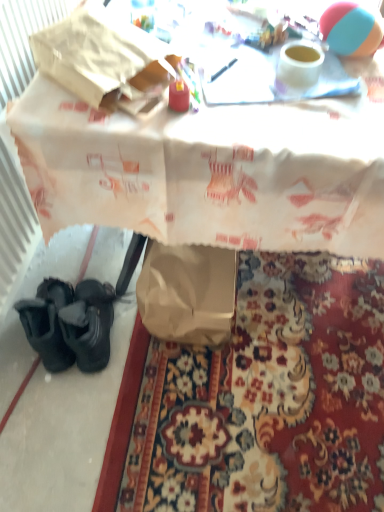
Image resolution: width=384 pixels, height=512 pixels. What do you see at coordinates (270, 398) in the screenshot? I see `brown paper bag at lower left` at bounding box center [270, 398].

What are the coordinates of `rubber beach ball at upper right` in the screenshot? It's located at (351, 29).

Consider the image. Measure the distance between white paper bag at lower left and camera.

The depth of white paper bag at lower left is 30.29 inches.

I want to click on brown paper bag at lower left, so click(270, 398).

Is point (339, 23) positioned before point (243, 438)?

Yes, point (339, 23) is closer to viewer.

Does rubber beach ball at upper right come behind brown paper bag at lower left?

No.

From the picture: From a real-world perspective, does rubber beach ball at upper right sit lower than brown paper bag at lower left?

Actually, rubber beach ball at upper right is physically above brown paper bag at lower left in the real world.

Does rubber beach ball at upper right have a smaller size compared to brown paper bag at lower left?

Yes, rubber beach ball at upper right is smaller than brown paper bag at lower left.

Between white paper bag at lower left and rubber beach ball at upper right, which one appears on the left side from the viewer's perspective?

From the viewer's perspective, white paper bag at lower left appears more on the left side.

Can you confirm if white paper bag at lower left is bigger than rubber beach ball at upper right?

Correct, white paper bag at lower left is larger in size than rubber beach ball at upper right.

What's the angular difference between white paper bag at lower left and rubber beach ball at upper right's facing directions?

white paper bag at lower left and rubber beach ball at upper right are facing 0.107 degrees away from each other.

From the image's perspective, is white paper bag at lower left on top of brown paper bag at lower left?

Yes, from the image's perspective, white paper bag at lower left is over brown paper bag at lower left.

From a real-world perspective, between white paper bag at lower left and brown paper bag at lower left, who is vertically lower?

brown paper bag at lower left, from a real-world perspective.

Between white paper bag at lower left and brown paper bag at lower left, which one is positioned behind?

brown paper bag at lower left is more distant.

From a real-world perspective, is rubber beach ball at upper right physically below white paper bag at lower left?

No.

Is rubber beach ball at upper right in front of or behind white paper bag at lower left in the image?

Answer: In the image, rubber beach ball at upper right appears behind white paper bag at lower left.

Would you say rubber beach ball at upper right is to the left or to the right of white paper bag at lower left in the picture?

From the image, it's evident that rubber beach ball at upper right is to the right of white paper bag at lower left.

Is brown paper bag at lower left oriented towards rubber beach ball at upper right?

No, brown paper bag at lower left is not turned towards rubber beach ball at upper right.

Does brown paper bag at lower left have a lesser width compared to rubber beach ball at upper right?

Incorrect, the width of brown paper bag at lower left is not less than that of rubber beach ball at upper right.

Is brown paper bag at lower left outside of rubber beach ball at upper right?

brown paper bag at lower left is positioned outside rubber beach ball at upper right.

Which of these two, brown paper bag at lower left or rubber beach ball at upper right, is smaller?

Smaller between the two is rubber beach ball at upper right.

Considering the positions of objects brown paper bag at lower left and white paper bag at lower left in the image provided, who is behind, brown paper bag at lower left or white paper bag at lower left?

brown paper bag at lower left is behind.

How many degrees apart are the facing directions of brown paper bag at lower left and white paper bag at lower left?

They differ by 179 degrees in their facing directions.

Can you confirm if brown paper bag at lower left is positioned to the left of white paper bag at lower left?

Correct, you'll find brown paper bag at lower left to the left of white paper bag at lower left.

Measure the distance between brown paper bag at lower left and white paper bag at lower left.

A distance of 18.45 inches exists between brown paper bag at lower left and white paper bag at lower left.

At what (x,y) coordinates should I click in order to perform the action: click on mat directly beneath the rubber beach ball at upper right (from a real-world perspective). Please return your answer as a coordinate pair (x, y). Looking at the image, I should click on (270, 398).

This screenshot has width=384, height=512. Identify the location of ball on the right of white paper bag at lower left. click(x=351, y=29).

From the image, which object appears to be farther from brown paper bag at lower left, white paper bag at lower left or rubber beach ball at upper right?

rubber beach ball at upper right lies further to brown paper bag at lower left than the other object.

Based on the photo, considering their positions, is rubber beach ball at upper right positioned closer to brown paper bag at lower left than white paper bag at lower left?

The object closer to brown paper bag at lower left is white paper bag at lower left.

From the image, which object appears to be farther from white paper bag at lower left, rubber beach ball at upper right or brown paper bag at lower left?

brown paper bag at lower left lies further to white paper bag at lower left than the other object.

Estimate the real-world distances between objects in this image. Which object is further from rubber beach ball at upper right, white paper bag at lower left or brown paper bag at lower left?

brown paper bag at lower left.

From the image, which object appears to be nearer to rubber beach ball at upper right, brown paper bag at lower left or white paper bag at lower left?

Based on the image, white paper bag at lower left appears to be nearer to rubber beach ball at upper right.

Looking at the image, which one is located further to white paper bag at lower left, brown paper bag at lower left or rubber beach ball at upper right?

brown paper bag at lower left lies further to white paper bag at lower left than the other object.

This screenshot has height=512, width=384. Identify the location of table between rubber beach ball at upper right and brown paper bag at lower left from top to bottom. (210, 172).